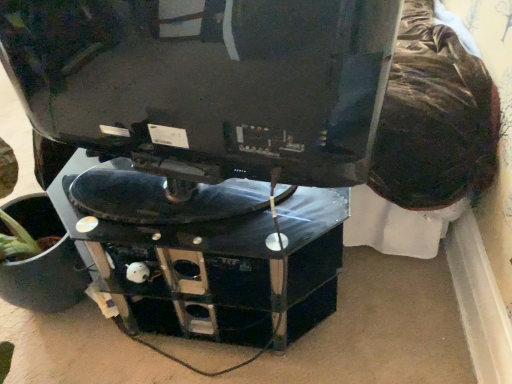
Question: Is matte black monitor at upper center not inside black glossy computer desk at center?

Choices:
 (A) yes
 (B) no

Answer: (A)

Question: Can you confirm if matte black monitor at upper center is shorter than black glossy computer desk at center?

Choices:
 (A) no
 (B) yes

Answer: (A)

Question: Can you confirm if matte black monitor at upper center is wider than black glossy computer desk at center?

Choices:
 (A) yes
 (B) no

Answer: (B)

Question: Are matte black monitor at upper center and black glossy computer desk at center beside each other?

Choices:
 (A) no
 (B) yes

Answer: (A)

Question: Would you say matte black monitor at upper center is a long distance from black glossy computer desk at center?

Choices:
 (A) yes
 (B) no

Answer: (B)

Question: From a real-world perspective, is matte black monitor at upper center below black glossy computer desk at center?

Choices:
 (A) no
 (B) yes

Answer: (A)

Question: Does black glossy computer desk at center have a greater height compared to matte black monitor at upper center?

Choices:
 (A) yes
 (B) no

Answer: (B)

Question: Is black glossy computer desk at center to the left of matte black monitor at upper center from the viewer's perspective?

Choices:
 (A) no
 (B) yes

Answer: (A)

Question: Is matte black monitor at upper center at the back of black glossy computer desk at center?

Choices:
 (A) no
 (B) yes

Answer: (A)

Question: Does black glossy computer desk at center have a greater width compared to matte black monitor at upper center?

Choices:
 (A) yes
 (B) no

Answer: (A)

Question: From a real-world perspective, does black glossy computer desk at center sit lower than matte black monitor at upper center?

Choices:
 (A) no
 (B) yes

Answer: (B)

Question: Are black glossy computer desk at center and matte black monitor at upper center beside each other?

Choices:
 (A) no
 (B) yes

Answer: (A)

Question: In terms of size, does matte black monitor at upper center appear bigger or smaller than black glossy computer desk at center?

Choices:
 (A) small
 (B) big

Answer: (A)